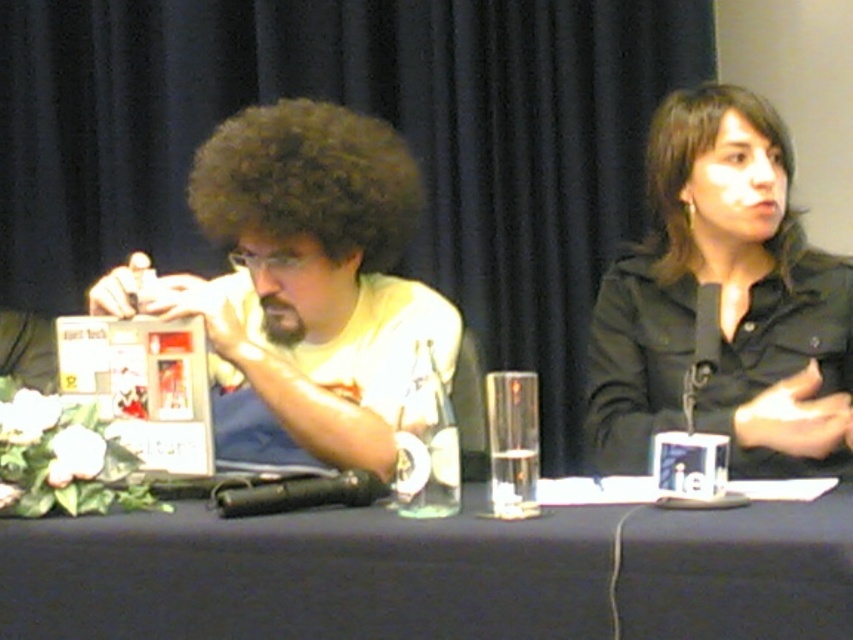
Does black fabric table at center appear on the left side of dark brown curly hair at center?

In fact, black fabric table at center is to the right of dark brown curly hair at center.

Does black fabric table at center have a lesser width compared to dark brown curly hair at center?

Incorrect, black fabric table at center's width is not less than dark brown curly hair at center's.

Which is in front, point (450, 589) or point (225, 236)?

Positioned in front is point (450, 589).

Where is `black fabric table at center`? Image resolution: width=853 pixels, height=640 pixels. black fabric table at center is located at coordinates (306, 576).

Does dark brown curly hair at center lie in front of dark brown curly hair at upper right?

That is True.

Is point (289, 152) positioned after point (724, 102)?

No, (289, 152) is in front of (724, 102).

The image size is (853, 640). I want to click on dark brown curly hair at center, so click(x=308, y=180).

Based on the photo, is white matte t-shirt at left thinner than black matte shirt at upper right?

In fact, white matte t-shirt at left might be wider than black matte shirt at upper right.

Can you confirm if white matte t-shirt at left is bigger than black matte shirt at upper right?

No.

Does point (351, 413) come in front of point (838, 452)?

That is True.

You are a GUI agent. You are given a task and a screenshot of the screen. Output one action in this format:
    pyautogui.click(x=<x>, y=<y>)
    Task: Click on the white matte t-shirt at left
    The height and width of the screenshot is (640, 853).
    Given the screenshot: What is the action you would take?
    pyautogui.click(x=312, y=276)